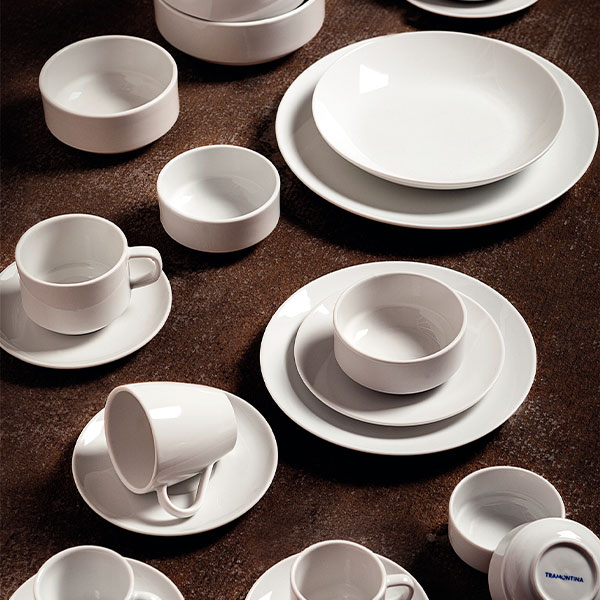
This screenshot has height=600, width=600. Find the location of `dinnerware brand stamp`. dinnerware brand stamp is located at coordinates (562, 576).